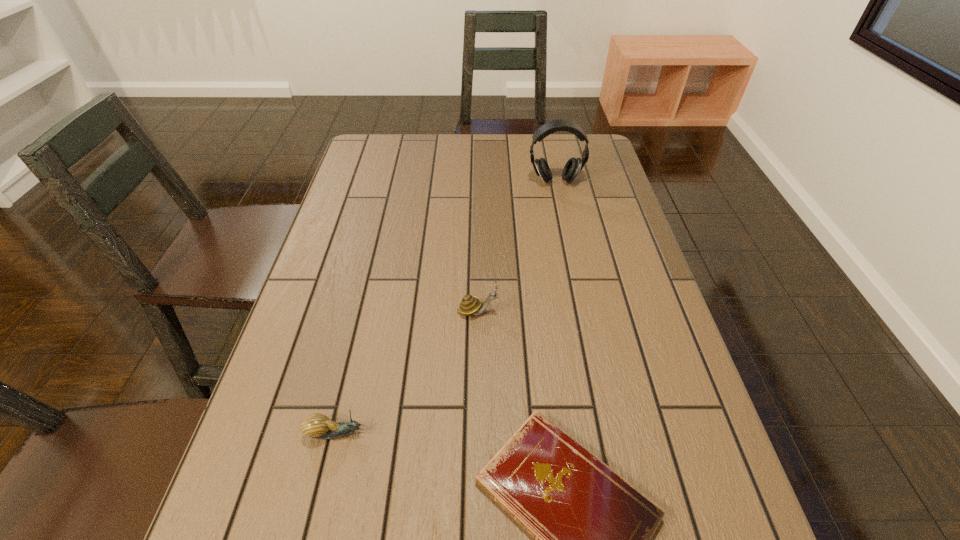
Find the location of a particular element. This screenshot has width=960, height=540. free location that satisfies the following two spatial constraints: 1. on the ear cups of the earphone; 2. on the front-facing side of the leftmost object is located at coordinates (607, 433).

I want to click on blank space that satisfies the following two spatial constraints: 1. on the ear cups of the tallest object; 2. on the front-facing side of the shorter escargot, so click(607, 433).

Locate an element on the screen. The width and height of the screenshot is (960, 540). vacant area that satisfies the following two spatial constraints: 1. on the ear cups of the farthest object; 2. on the face of the taller escargot is located at coordinates (582, 311).